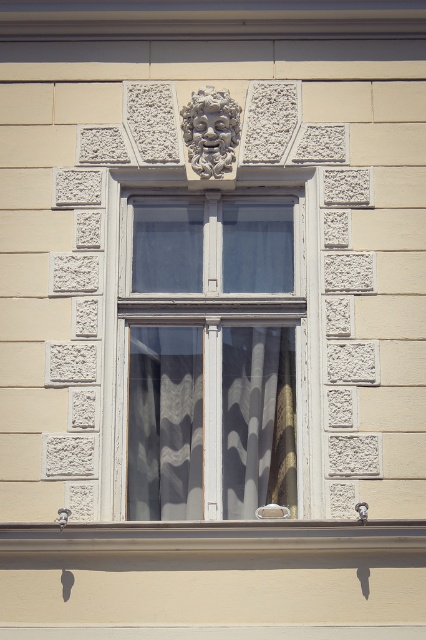
Question: Which of the following is the closest to the observer?

Choices:
 (A) white wood window at center
 (B) white lace curtain at center

Answer: (A)

Question: In this image, where is white wood window at center located relative to white lace curtain at center?

Choices:
 (A) below
 (B) above

Answer: (B)

Question: Which object appears closest to the camera in this image?

Choices:
 (A) white wood window at center
 (B) white lace curtain at center

Answer: (A)

Question: Does white wood window at center have a larger size compared to white lace curtain at center?

Choices:
 (A) no
 (B) yes

Answer: (B)

Question: Does white wood window at center appear under white lace curtain at center?

Choices:
 (A) no
 (B) yes

Answer: (A)